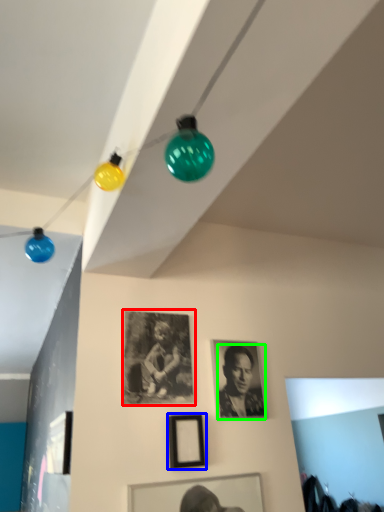
Question: Which is nearer to the picture frame (highlighted by a red box)? picture frame (highlighted by a blue box) or person (highlighted by a green box).

Choices:
 (A) picture frame
 (B) person

Answer: (A)